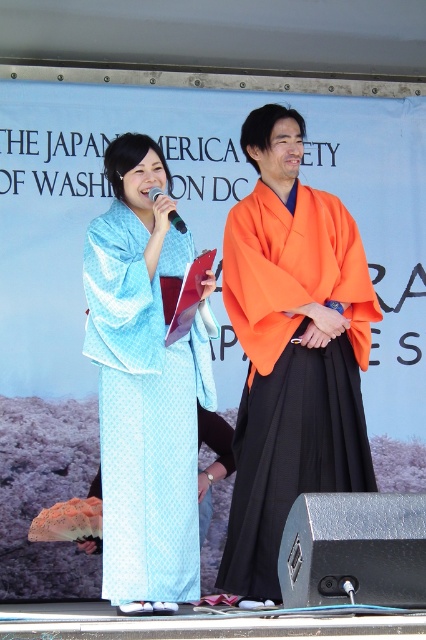
You are a photographer at the event and need to capture a photo of both the light blue silk kimono at center and the orange silk kimono at center. The camera you are using has a minimum focus distance of 28 inches. Can you take a photo of both kimonos without moving either of them?

The light blue silk kimono at center and orange silk kimono at center are 28.60 inches apart from each other. Since the distance between them is slightly more than the camera minimum focus distance of 28 inches, you can take a photo of both kimonos without moving either of them.

You are an event photographer at the cultural event. You need to capture a closeup shot of the orange silk kimono at center and the black plastic microphone at center. Which object should you zoom in on to ensure it fits better in the frame?

The orange silk kimono at center has a larger width than the black plastic microphone at center, so you should zoom in on the orange silk kimono at center to ensure it fits better in the frame.

Looking at this image, you are an event photographer at the Japan America Society event. You need to capture a photo where both the light blue silk kimono at center and the black plastic microphone at center are visible. Based on their positions, which object should you focus on first to ensure both are in frame?

The light blue silk kimono at center is below the black plastic microphone at center. To ensure both are in frame, focus on the black plastic microphone at center first as it is higher up, allowing the kimono to naturally fall into the lower part of the frame.